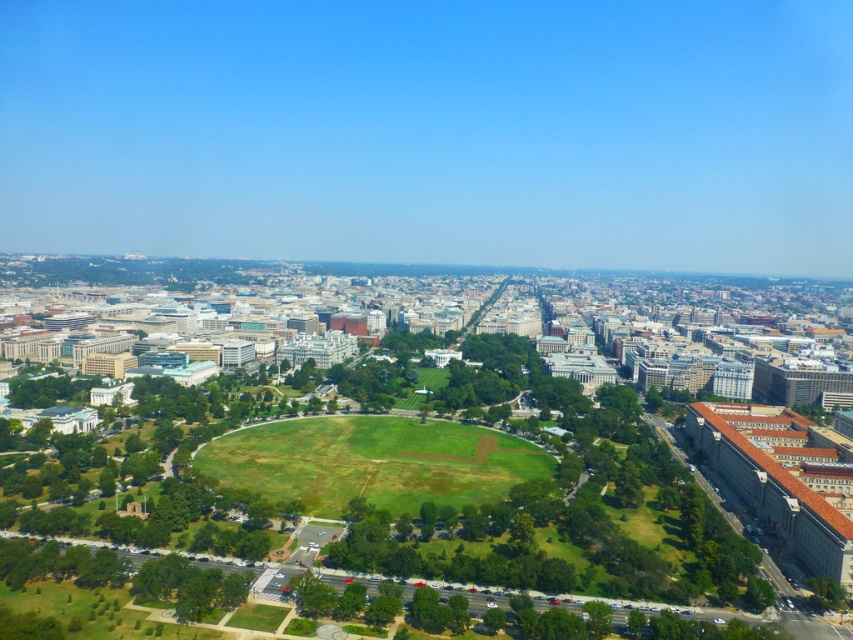
You are standing at the center of the park in the cityscape image. You see a point marked at coordinates (x=498, y=506). What is the nearest object to this point?

The point at (x=498, y=506) is on the green leafy tree at center, so the nearest object to this point is the green leafy tree at center.

You are a drone operator who needs to fly a drone over the cityscape. The drone has a maximum flight height of 5 meters. Considering the green leafy tree at center and the green grassy field at center, which object will the drone encounter first if it flies straight upwards from the grassy field?

The drone will encounter the green leafy tree at center first because it is taller than the green grassy field at center, so the tree is higher up in the air.

You are standing in the city park and want to find a spot to have a picnic. You see the green leafy tree at center and the green grassy field at center. Which one should you choose if you prefer a shaded area?

The green leafy tree at center is positioned on the right side of green grassy field at center. Since trees provide shade, you should choose the green leafy tree at center for a shaded picnic spot.